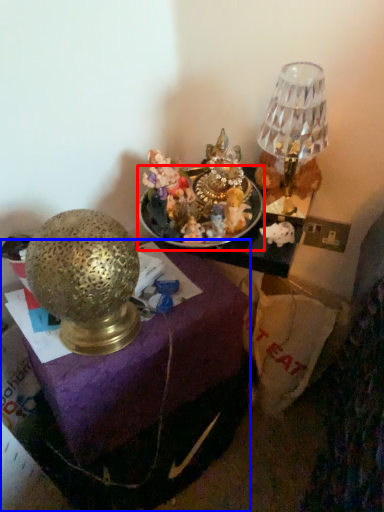
Question: Which object is closer to the camera taking this photo, tableware (highlighted by a red box) or furniture (highlighted by a blue box)?

Choices:
 (A) tableware
 (B) furniture

Answer: (B)